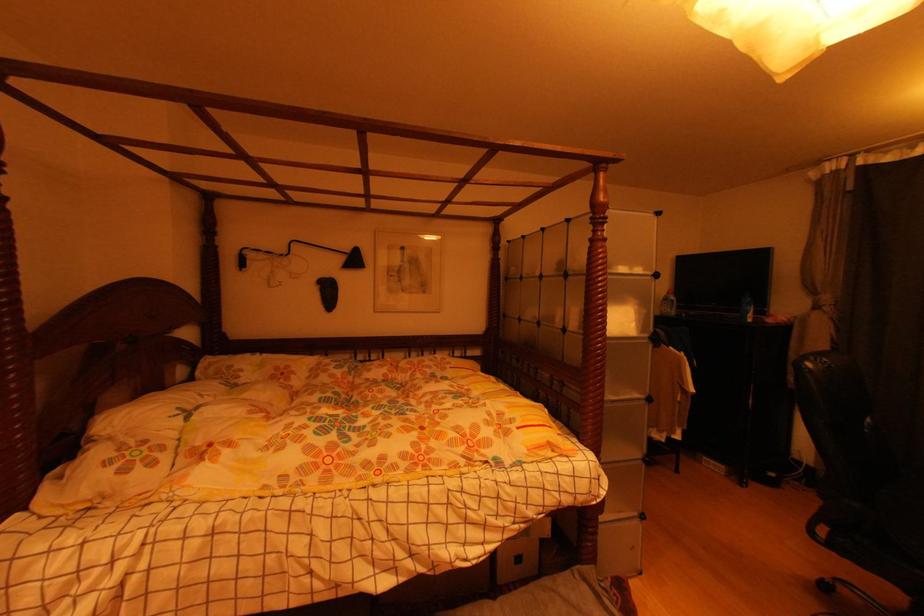
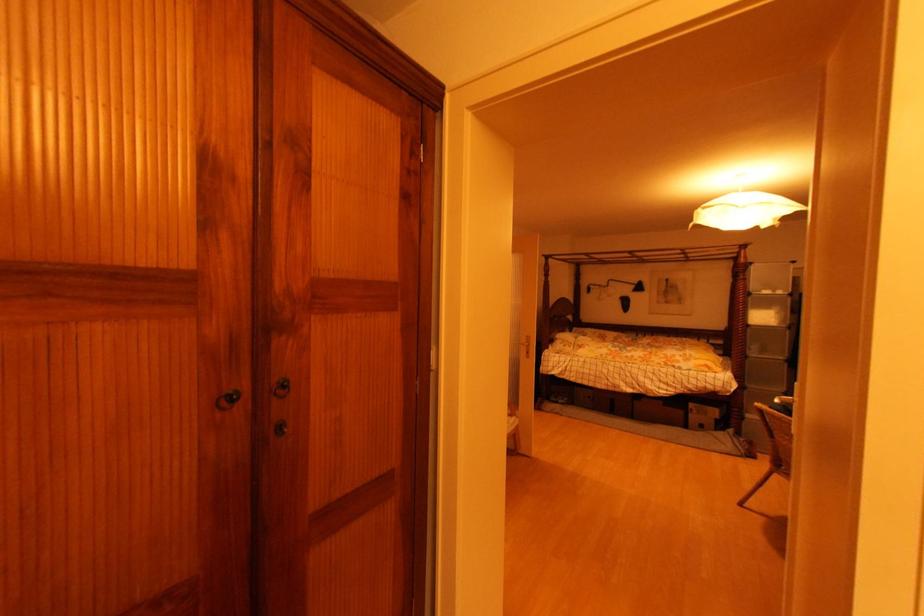
Locate, in the second image, the point that corresponds to point 346,261 in the first image.

(638, 288)